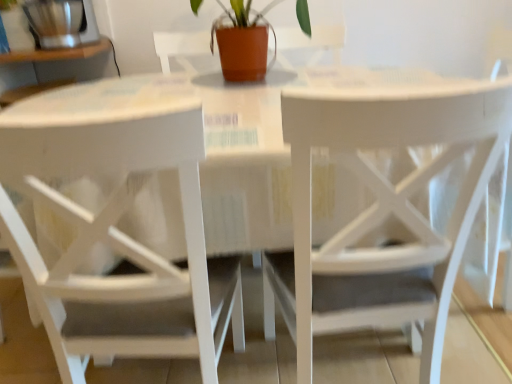
Question: Considering the relative positions of white wood chair at center, which appears as the second chair when viewed from the right, and brushed metal coffee grinder at upper left in the image provided, is white wood chair at center, which appears as the second chair when viewed from the right, behind brushed metal coffee grinder at upper left?

Choices:
 (A) no
 (B) yes

Answer: (A)

Question: Considering the relative sizes of white wood chair at center, which ranks as the first chair in left-to-right order, and brushed metal coffee grinder at upper left in the image provided, is white wood chair at center, which ranks as the first chair in left-to-right order, shorter than brushed metal coffee grinder at upper left?

Choices:
 (A) no
 (B) yes

Answer: (A)

Question: From a real-world perspective, is white wood chair at center, which appears as the second chair when viewed from the right, positioned over brushed metal coffee grinder at upper left based on gravity?

Choices:
 (A) no
 (B) yes

Answer: (A)

Question: Is white wood chair at center, which appears as the second chair when viewed from the right, outside brushed metal coffee grinder at upper left?

Choices:
 (A) yes
 (B) no

Answer: (A)

Question: Is white wood chair at center, which appears as the second chair when viewed from the right, looking in the opposite direction of brushed metal coffee grinder at upper left?

Choices:
 (A) yes
 (B) no

Answer: (B)

Question: In the image, is white matte chair at center, arranged as the first chair when viewed from the right, positioned in front of or behind terracotta clay pot at center?

Choices:
 (A) front
 (B) behind

Answer: (A)

Question: Would you say white matte chair at center, the second chair positioned from the left, is to the left or to the right of terracotta clay pot at center in the picture?

Choices:
 (A) right
 (B) left

Answer: (A)

Question: From a real-world perspective, is white matte chair at center, arranged as the first chair when viewed from the right, physically located above or below terracotta clay pot at center?

Choices:
 (A) above
 (B) below

Answer: (B)

Question: Considering the positions of white matte chair at center, arranged as the first chair when viewed from the right, and terracotta clay pot at center in the image, is white matte chair at center, arranged as the first chair when viewed from the right, bigger or smaller than terracotta clay pot at center?

Choices:
 (A) big
 (B) small

Answer: (A)

Question: In terms of size, does white wood chair at center, which ranks as the first chair in left-to-right order, appear bigger or smaller than white matte chair at center, arranged as the first chair when viewed from the right?

Choices:
 (A) small
 (B) big

Answer: (A)

Question: In the image, is white wood chair at center, which appears as the second chair when viewed from the right, positioned in front of or behind white matte chair at center, arranged as the first chair when viewed from the right?

Choices:
 (A) front
 (B) behind

Answer: (A)

Question: Considering the positions of point (10, 139) and point (375, 284), is point (10, 139) closer or farther from the camera than point (375, 284)?

Choices:
 (A) closer
 (B) farther

Answer: (A)

Question: From their relative heights in the image, would you say white wood chair at center, which appears as the second chair when viewed from the right, is taller or shorter than white matte chair at center, arranged as the first chair when viewed from the right?

Choices:
 (A) short
 (B) tall

Answer: (A)

Question: Looking at their shapes, would you say terracotta clay pot at center is wider or thinner than brushed metal coffee grinder at upper left?

Choices:
 (A) wide
 (B) thin

Answer: (A)

Question: In terms of size, does terracotta clay pot at center appear bigger or smaller than brushed metal coffee grinder at upper left?

Choices:
 (A) small
 (B) big

Answer: (B)